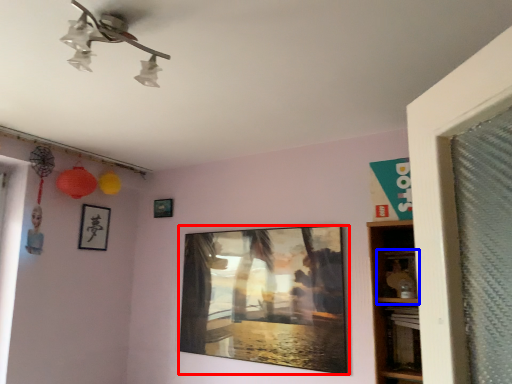
Question: Which object is further to the camera taking this photo, picture frame (highlighted by a red box) or shelf (highlighted by a blue box)?

Choices:
 (A) picture frame
 (B) shelf

Answer: (A)